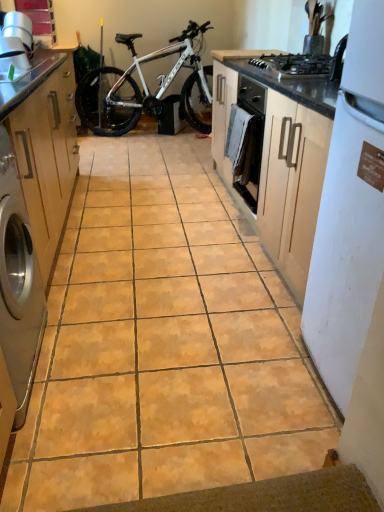
At what (x,y) coordinates should I click in order to perform the action: click on unoccupied space behind satin silver washing machine at left. Please return your answer as a coordinate pair (x, y). The height and width of the screenshot is (512, 384). Looking at the image, I should click on (86, 304).